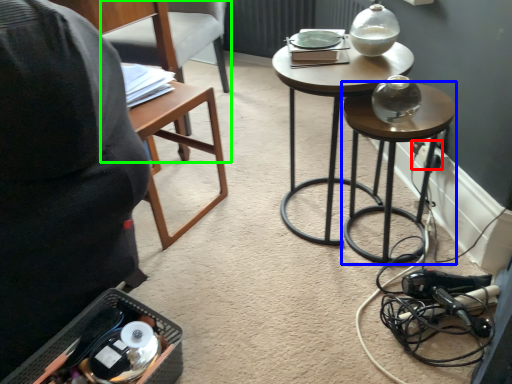
Question: Which object is the farthest from electric outlet (highlighted by a red box)? Choose among these: stool (highlighted by a blue box) or chair (highlighted by a green box).

Choices:
 (A) stool
 (B) chair

Answer: (B)